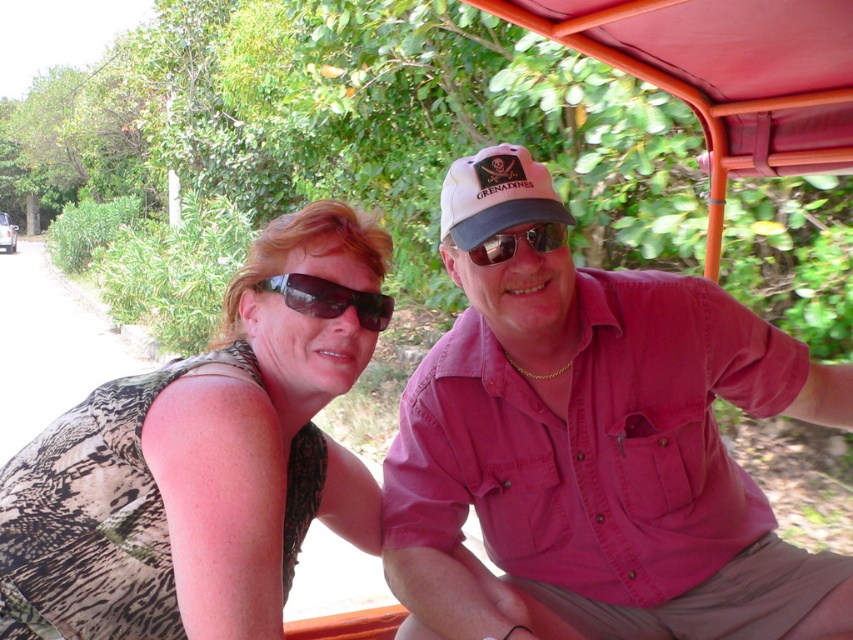
Question: Where is black fabric baseball cap at center located in relation to sunglasses at center in the image?

Choices:
 (A) left
 (B) right

Answer: (A)

Question: Which object is farther from the camera taking this photo?

Choices:
 (A) sunglasses at center
 (B) black fabric baseball cap at center

Answer: (A)

Question: Among these objects, which one is nearest to the camera?

Choices:
 (A) black matte sunglasses at center
 (B) sunglasses at center
 (C) printed fabric tank top at left
 (D) black fabric baseball cap at center

Answer: (C)

Question: Among these points, which one is farthest from the camera?

Choices:
 (A) (552, 192)
 (B) (496, 244)

Answer: (A)

Question: In this image, where is printed fabric tank top at left located relative to black matte sunglasses at center?

Choices:
 (A) left
 (B) right

Answer: (A)

Question: Is black matte sunglasses at center below sunglasses at center?

Choices:
 (A) no
 (B) yes

Answer: (B)